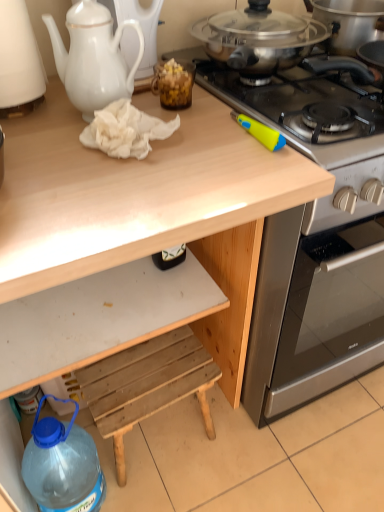
Question: Is stainless steel gas stove at upper right oriented towards white porcelain teapot at upper left?

Choices:
 (A) yes
 (B) no

Answer: (B)

Question: Is stainless steel gas stove at upper right closer to the viewer compared to white porcelain teapot at upper left?

Choices:
 (A) yes
 (B) no

Answer: (B)

Question: Considering the relative sizes of stainless steel gas stove at upper right and white porcelain teapot at upper left in the image provided, is stainless steel gas stove at upper right thinner than white porcelain teapot at upper left?

Choices:
 (A) no
 (B) yes

Answer: (A)

Question: Is there a large distance between stainless steel gas stove at upper right and white porcelain teapot at upper left?

Choices:
 (A) yes
 (B) no

Answer: (B)

Question: From the image's perspective, is stainless steel gas stove at upper right over white porcelain teapot at upper left?

Choices:
 (A) no
 (B) yes

Answer: (A)

Question: From a real-world perspective, is stainless steel gas stove at upper right physically above white porcelain teapot at upper left?

Choices:
 (A) no
 (B) yes

Answer: (A)

Question: Does translucent brown jar at upper center have a lesser width compared to stainless steel gas stove at upper right?

Choices:
 (A) yes
 (B) no

Answer: (A)

Question: Is translucent brown jar at upper center oriented away from stainless steel gas stove at upper right?

Choices:
 (A) yes
 (B) no

Answer: (B)

Question: Is translucent brown jar at upper center far away from stainless steel gas stove at upper right?

Choices:
 (A) yes
 (B) no

Answer: (B)

Question: From the image's perspective, is translucent brown jar at upper center beneath stainless steel gas stove at upper right?

Choices:
 (A) no
 (B) yes

Answer: (B)

Question: Is the position of translucent brown jar at upper center less distant than that of stainless steel gas stove at upper right?

Choices:
 (A) yes
 (B) no

Answer: (B)

Question: Is translucent brown jar at upper center positioned beyond the bounds of stainless steel gas stove at upper right?

Choices:
 (A) no
 (B) yes

Answer: (B)

Question: Is white matte drawer at lower center closer to camera compared to wooden step stool at lower center?

Choices:
 (A) no
 (B) yes

Answer: (B)